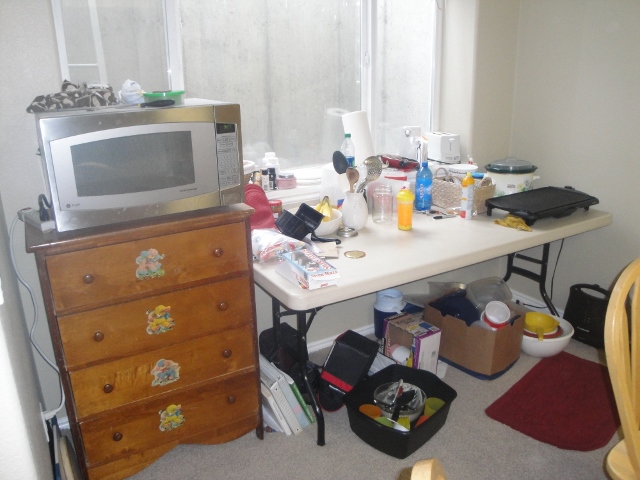
In order to click on wall in this screenshot , I will do `click(603, 85)`, `click(619, 175)`.